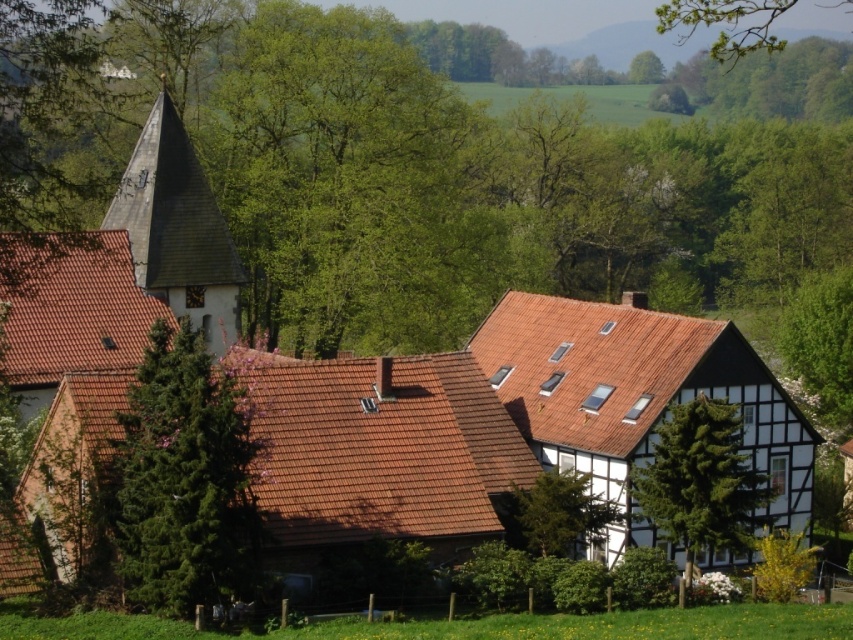
Question: In this image, where is matte brown steeple at left located relative to green leafy tree at center?

Choices:
 (A) left
 (B) right

Answer: (A)

Question: Is green leafy tree at center to the left of green leafy tree at upper center from the viewer's perspective?

Choices:
 (A) no
 (B) yes

Answer: (B)

Question: Which of these objects is positioned closest to the green leafy tree at upper center?

Choices:
 (A) matte brown steeple at left
 (B) green leafy tree at upper right
 (C) green textured tree at center

Answer: (B)

Question: Estimate the real-world distances between objects in this image. Which object is farther from the green coniferous tree at center?

Choices:
 (A) green leafy tree at upper center
 (B) green textured tree at center

Answer: (A)

Question: Among these objects, which one is nearest to the camera?

Choices:
 (A) green leafy tree at center
 (B) matte brown steeple at left
 (C) green leafy tree at upper right

Answer: (B)

Question: Considering the relative positions of green textured tree at center and green leafy tree at upper center in the image provided, where is green textured tree at center located with respect to green leafy tree at upper center?

Choices:
 (A) right
 (B) left

Answer: (B)